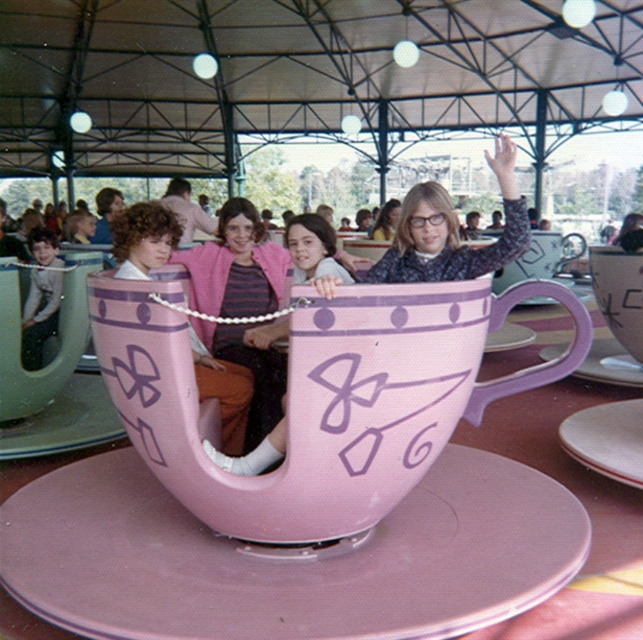
You are a parent at the fairground looking for your child who is either in the pink matte saucer at center or the matte white teacup at upper right. You notice that one of the rides is lower to the ground, making it easier to spot shorter children. Which ride should you look at?

The pink matte saucer at center has a lesser height compared to the matte white teacup at upper right, so you should look at the pink matte saucer at center as it is lower to the ground and easier to spot shorter children.

You are designing a display for a tea set and need to place the white glossy saucer at lower right and the matte white teacup at upper right. According to the image, which object should be placed lower to ensure proper alignment with their sizes?

The white glossy saucer at lower right is larger in size than the matte white teacup at upper right, so it should be placed lower to maintain proper alignment based on their sizes.

You are a photographer positioned at the front of the ride. You want to take a photo of the white glossy saucer at center without the matte pink sweater at center blocking it. Is this possible?

The matte pink sweater at center is in front of the white glossy saucer at center, so you cannot take a photo of the white glossy saucer at center without the matte pink sweater at center blocking it.